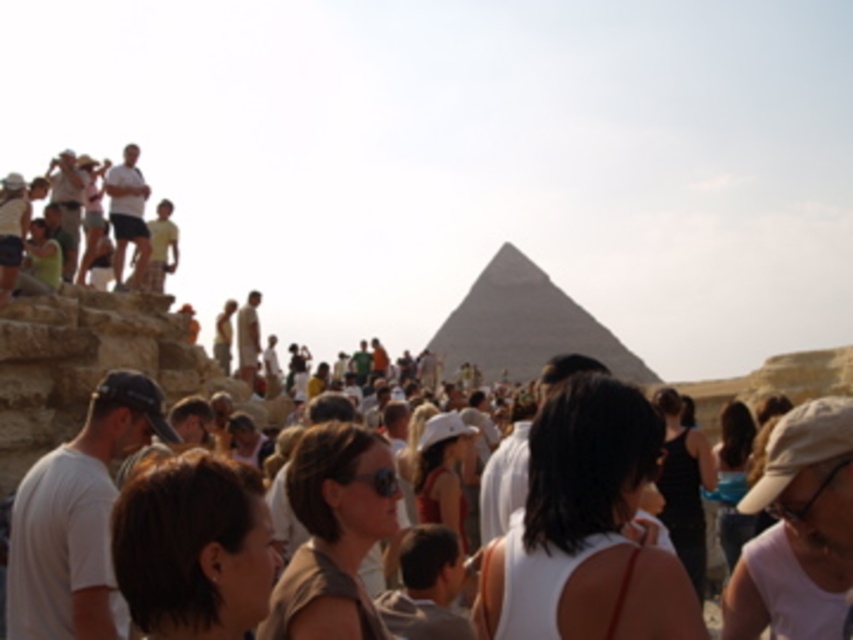
Who is positioned more to the left, white fabric dress at center or white cotton shirt at left?

Answer: white cotton shirt at left

Can you confirm if white fabric dress at center is shorter than white cotton shirt at left?

No, white fabric dress at center is not shorter than white cotton shirt at left.

Which is behind, point (596, 618) or point (73, 531)?

The point (73, 531) is behind.

Identify the location of white fabric dress at center. The height and width of the screenshot is (640, 853). (585, 529).

Is point (184, 563) positioned after point (453, 310)?

No, it is in front of (453, 310).

Does dark brown hair at center lie in front of gray stone pyramid at center?

Yes, it is in front of gray stone pyramid at center.

Who is more distant from viewer, (x=184, y=540) or (x=509, y=276)?

The point (x=509, y=276) is more distant.

Locate an element on the screen. The width and height of the screenshot is (853, 640). dark brown hair at center is located at coordinates (193, 548).

Can you confirm if white fabric cap at center is positioned above gray stone pyramid at center?

No.

Describe the element at coordinates (798, 529) in the screenshot. I see `white fabric cap at center` at that location.

The height and width of the screenshot is (640, 853). Find the location of `white fabric cap at center`. white fabric cap at center is located at coordinates (798, 529).

Locate an element on the screen. The width and height of the screenshot is (853, 640). white fabric cap at center is located at coordinates (798, 529).